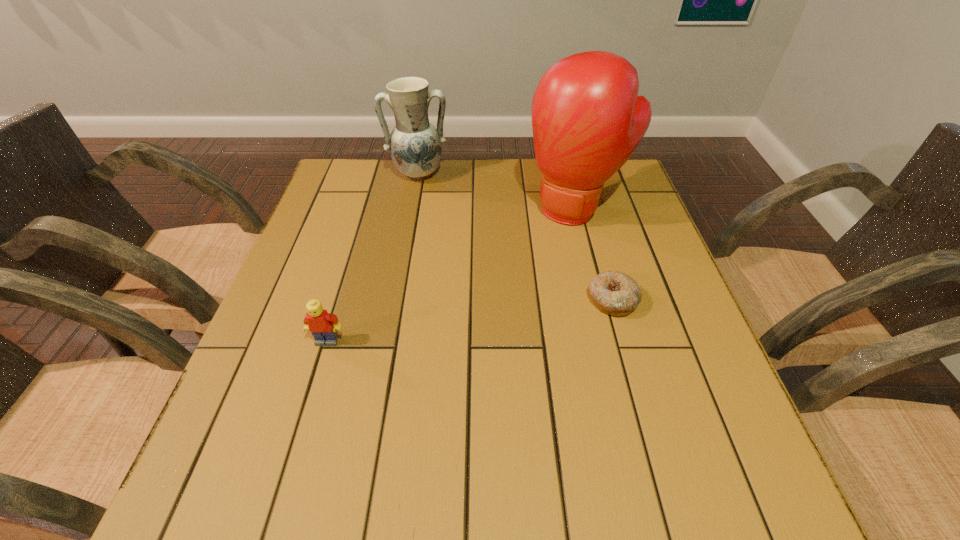
Image resolution: width=960 pixels, height=540 pixels. In order to click on free spot at the far edge of the desktop in this screenshot , I will do `click(540, 186)`.

In the image, there is a desktop. Where is `free space at the left edge`? free space at the left edge is located at coordinates (340, 285).

This screenshot has height=540, width=960. What are the coordinates of `vacant region at the right edge` in the screenshot? It's located at (631, 244).

Find the location of `vacant space at the far left corner`. vacant space at the far left corner is located at coordinates (344, 162).

This screenshot has height=540, width=960. I want to click on free space at the far right corner of the desktop, so click(x=622, y=169).

This screenshot has height=540, width=960. I want to click on vacant point located between the second tallest object and the third tallest object, so click(372, 258).

I want to click on vacant space that is in between the pottery and the shortest object, so click(516, 237).

Identify the location of free spot between the third farthest object and the third tallest object. The image size is (960, 540). (469, 320).

This screenshot has height=540, width=960. Identify the location of free space between the third shortest object and the tallest object. (496, 191).

Identify the location of vacant point located between the nearest object and the second nearest object. The height and width of the screenshot is (540, 960). (469, 320).